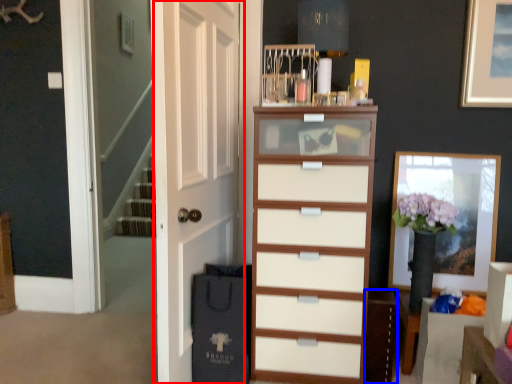
Question: Which object is closer to the camera taking this photo, door (highlighted by a red box) or cabinetry (highlighted by a blue box)?

Choices:
 (A) door
 (B) cabinetry

Answer: (A)